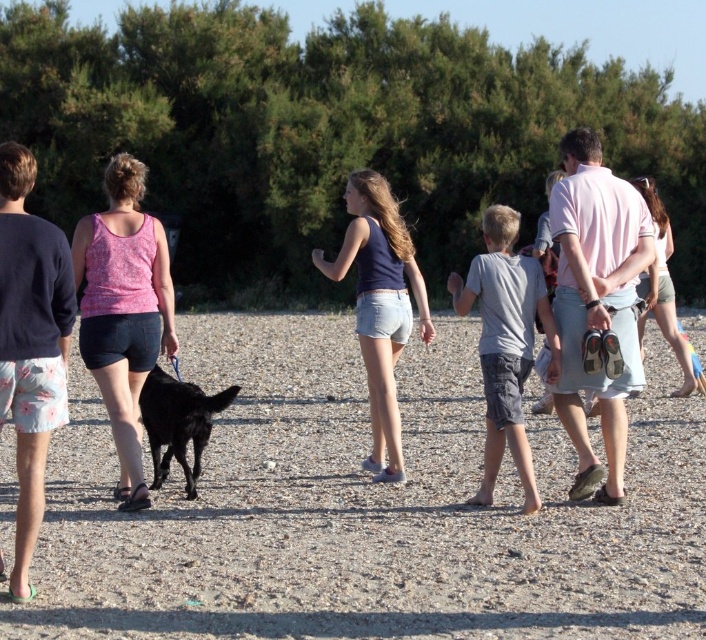
Question: Which point appears farthest from the camera in this image?

Choices:
 (A) (493, 234)
 (B) (385, 192)

Answer: (B)

Question: Does pink cotton shirt at right have a greater width compared to navy blue denim shorts at center?

Choices:
 (A) yes
 (B) no

Answer: (B)

Question: Which point is farther from the camera taking this photo?

Choices:
 (A) (479, 442)
 (B) (193, 403)
 (C) (688, 348)
 (D) (112, 212)

Answer: (C)

Question: Can you confirm if pink cotton shirt at right is thinner than matte pink tank top at center?

Choices:
 (A) no
 (B) yes

Answer: (A)

Question: Which point is closer to the camera taking this photo?

Choices:
 (A) click(181, 429)
 (B) click(124, 196)

Answer: (B)

Question: Is dirt at center to the right of pink cotton shirt at right from the viewer's perspective?

Choices:
 (A) no
 (B) yes

Answer: (A)